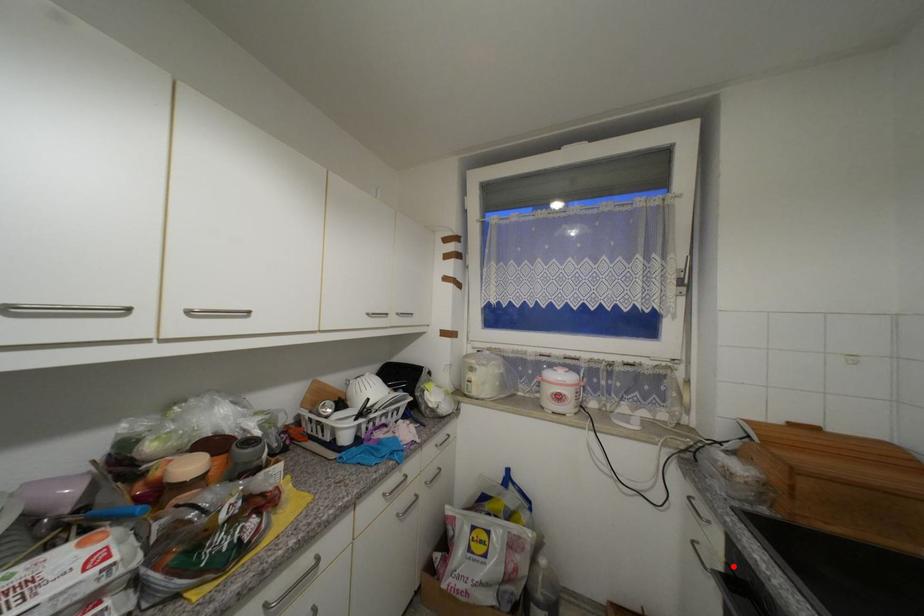
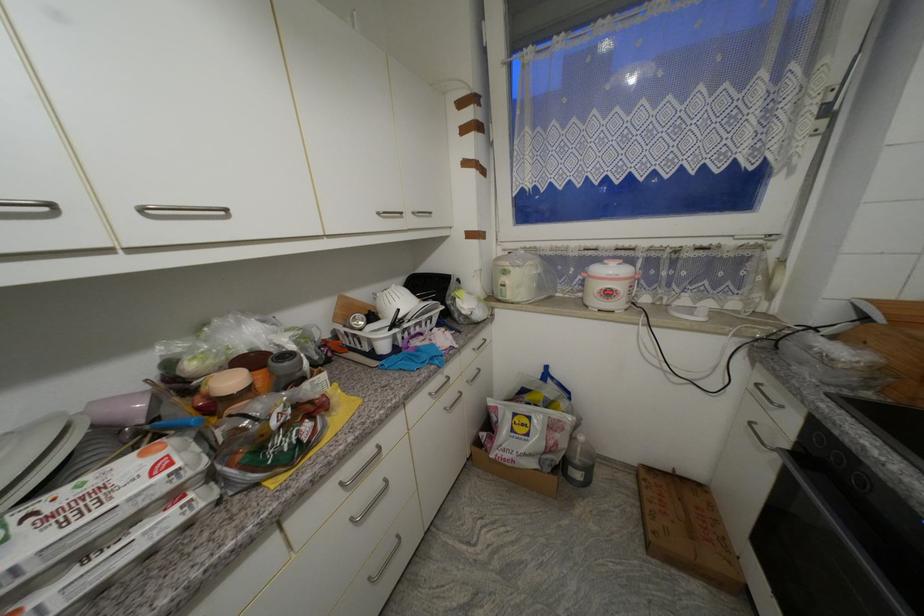
Locate, in the second image, the point that corresponds to the highlighted location in the first image.

(805, 446)